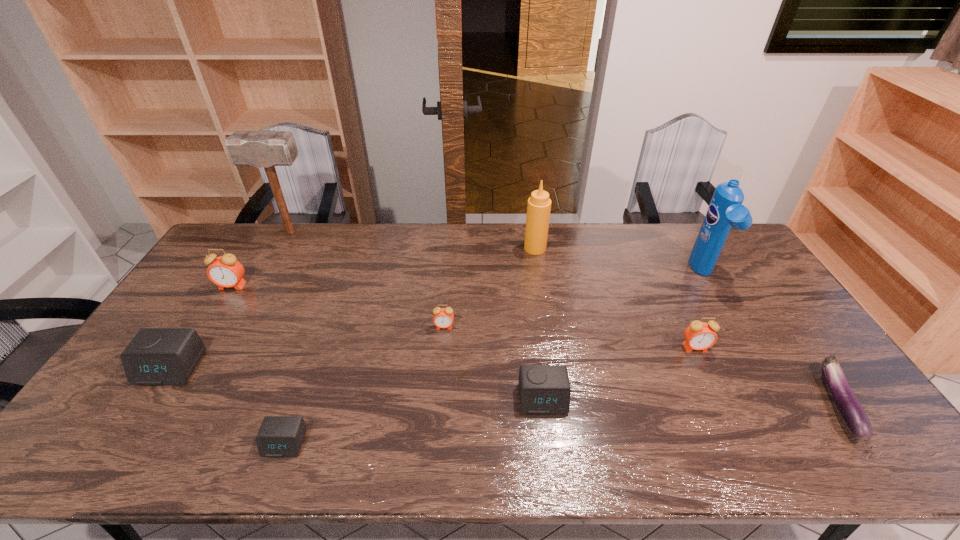
You are a GUI agent. You are given a task and a screenshot of the screen. Output one action in this format:
    pyautogui.click(x=<x>, y=<y>)
    Task: Click on the mallet
    
    Given the screenshot: What is the action you would take?
    pyautogui.click(x=266, y=149)

Find the location of a particular element. the second tallest object is located at coordinates (725, 210).

Identify the location of the second object from right to left. The image size is (960, 540). (725, 210).

Where is `the second farthest object`? The height and width of the screenshot is (540, 960). the second farthest object is located at coordinates (539, 204).

Find the location of a particular element. The height and width of the screenshot is (540, 960). tan condiment is located at coordinates (539, 204).

Identify the location of the farthest pink alarm clock. (225, 271).

The width and height of the screenshot is (960, 540). I want to click on the leftmost pink alarm clock, so click(x=225, y=271).

You are a GUI agent. You are given a task and a screenshot of the screen. Output one action in this format:
    pyautogui.click(x=<x>, y=<y>)
    Task: Click on the sixth shortest object
    
    Given the screenshot: What is the action you would take?
    pyautogui.click(x=699, y=335)

Locate an element on the screen. This screenshot has width=960, height=540. the eighth object from left to right is located at coordinates (699, 335).

Where is `the biggest black alarm clock`? the biggest black alarm clock is located at coordinates (155, 356).